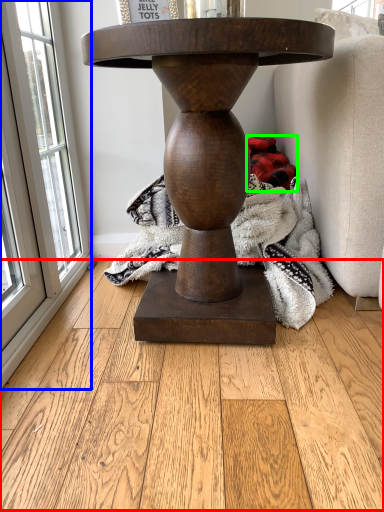
Question: Considering the real-world distances, which object is closest to hardwood (highlighted by a red box)? window (highlighted by a blue box) or material (highlighted by a green box).

Choices:
 (A) window
 (B) material

Answer: (A)